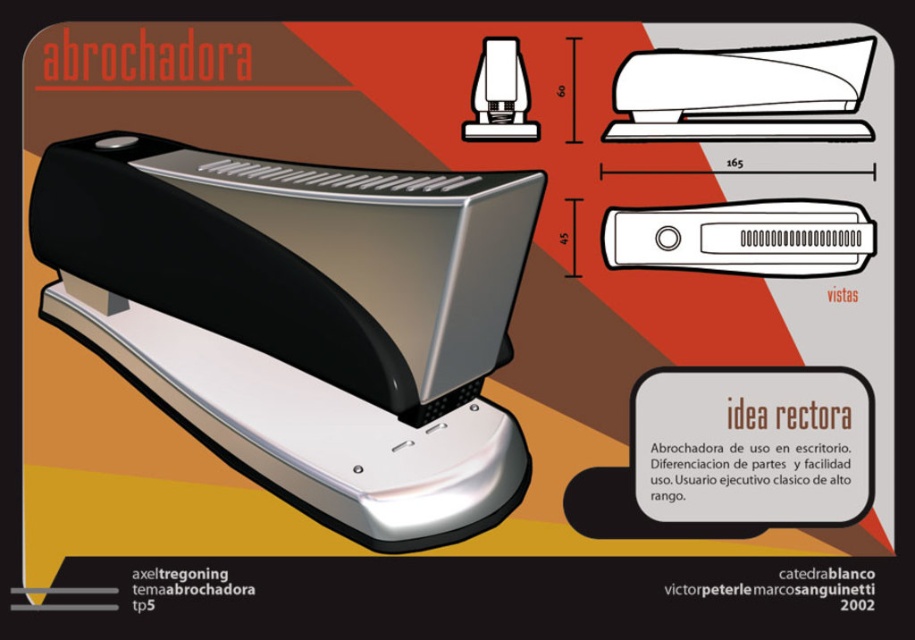
Question: Is matte black stapler at center below white plastic stapler at center?

Choices:
 (A) yes
 (B) no

Answer: (A)

Question: Which object is the farthest from the matte black stapler at center?

Choices:
 (A) white plastic stapler at center
 (B) white plastic stapler at upper center

Answer: (B)

Question: Observing the image, what is the correct spatial positioning of matte black stapler at center in reference to white plastic stapler at center?

Choices:
 (A) below
 (B) above

Answer: (A)

Question: Estimate the real-world distances between objects in this image. Which object is farther from the matte black stapler at upper center?

Choices:
 (A) matte black stapler at center
 (B) white plastic stapler at center
 (C) white plastic stapler at upper center

Answer: (A)

Question: Which point is farther to the camera?

Choices:
 (A) white plastic stapler at upper center
 (B) matte black stapler at upper center
 (C) matte black stapler at center

Answer: (B)

Question: Is matte black stapler at center to the right of white plastic stapler at upper center from the viewer's perspective?

Choices:
 (A) no
 (B) yes

Answer: (A)